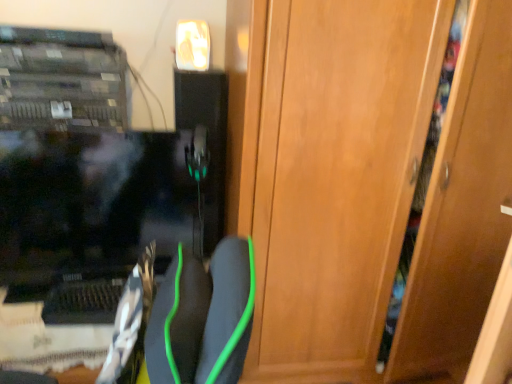
This screenshot has width=512, height=384. In order to click on wooden cupboard at right in this screenshot , I will do tap(374, 184).

Describe the element at coordinates (374, 184) in the screenshot. This screenshot has height=384, width=512. I see `wooden cupboard at right` at that location.

Identify the location of wooden cupboard at right. Image resolution: width=512 pixels, height=384 pixels. (374, 184).